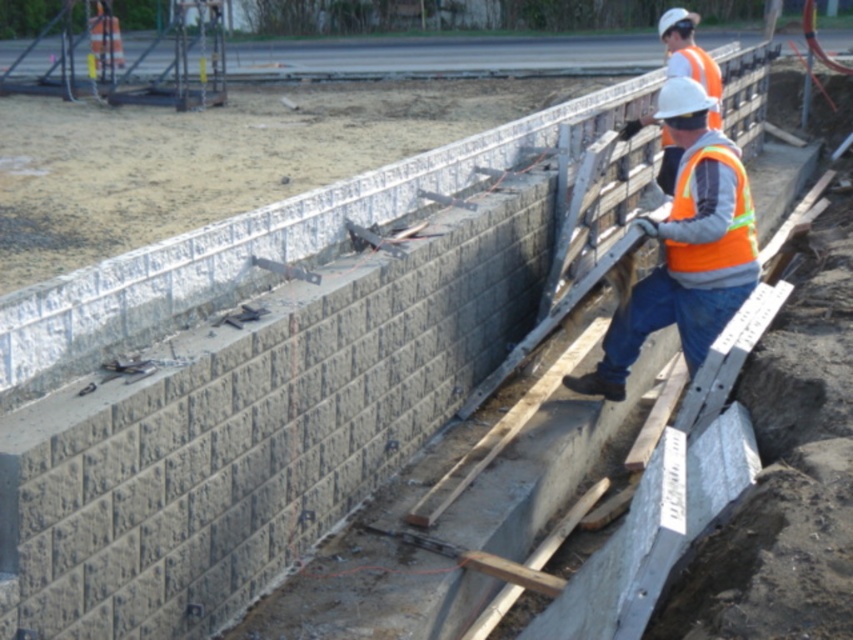
Question: Is orange reflective vest at upper right smaller than orange reflective safety vest at center?

Choices:
 (A) no
 (B) yes

Answer: (A)

Question: Which object is farther from the camera taking this photo?

Choices:
 (A) orange reflective vest at upper right
 (B) orange reflective safety vest at center

Answer: (B)

Question: Is orange reflective vest at upper right smaller than orange reflective safety vest at center?

Choices:
 (A) yes
 (B) no

Answer: (B)

Question: Can you confirm if orange reflective vest at upper right is positioned above orange reflective safety vest at center?

Choices:
 (A) no
 (B) yes

Answer: (A)

Question: Which object appears farthest from the camera in this image?

Choices:
 (A) orange reflective vest at upper right
 (B) orange reflective safety vest at center

Answer: (B)